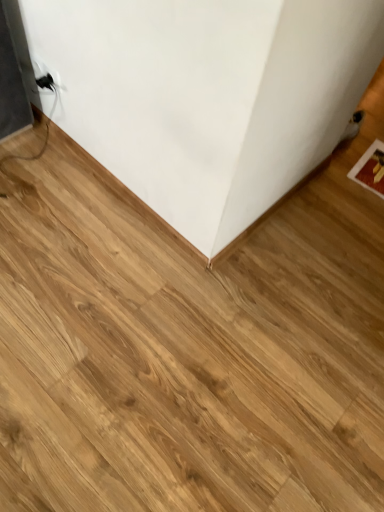
Question: From a real-world perspective, does black plastic electric outlet at upper left stand above wooden floor at center?

Choices:
 (A) yes
 (B) no

Answer: (A)

Question: Is black plastic electric outlet at upper left not within wooden floor at center?

Choices:
 (A) yes
 (B) no

Answer: (A)

Question: Does black plastic electric outlet at upper left have a greater height compared to wooden floor at center?

Choices:
 (A) no
 (B) yes

Answer: (B)

Question: Is black plastic electric outlet at upper left behind wooden floor at center?

Choices:
 (A) no
 (B) yes

Answer: (B)

Question: Could wooden floor at center be considered to be inside black plastic electric outlet at upper left?

Choices:
 (A) no
 (B) yes

Answer: (A)

Question: Is black plastic electric outlet at upper left looking in the opposite direction of wooden floor at center?

Choices:
 (A) no
 (B) yes

Answer: (A)

Question: Is wooden floor at center in contact with black plastic electric outlet at upper left?

Choices:
 (A) yes
 (B) no

Answer: (B)

Question: From a real-world perspective, is wooden floor at center positioned under black plastic electric outlet at upper left based on gravity?

Choices:
 (A) no
 (B) yes

Answer: (B)

Question: From a real-world perspective, is wooden floor at center located higher than black plastic electric outlet at upper left?

Choices:
 (A) yes
 (B) no

Answer: (B)

Question: Is black plastic electric outlet at upper left surrounded by wooden floor at center?

Choices:
 (A) no
 (B) yes

Answer: (A)

Question: Considering the relative positions of wooden floor at center and black plastic electric outlet at upper left in the image provided, is wooden floor at center to the left of black plastic electric outlet at upper left from the viewer's perspective?

Choices:
 (A) no
 (B) yes

Answer: (A)

Question: Does wooden floor at center have a lesser height compared to black plastic electric outlet at upper left?

Choices:
 (A) no
 (B) yes

Answer: (B)

Question: Considering their positions, is black plastic electric outlet at upper left located in front of or behind wooden floor at center?

Choices:
 (A) behind
 (B) front

Answer: (A)